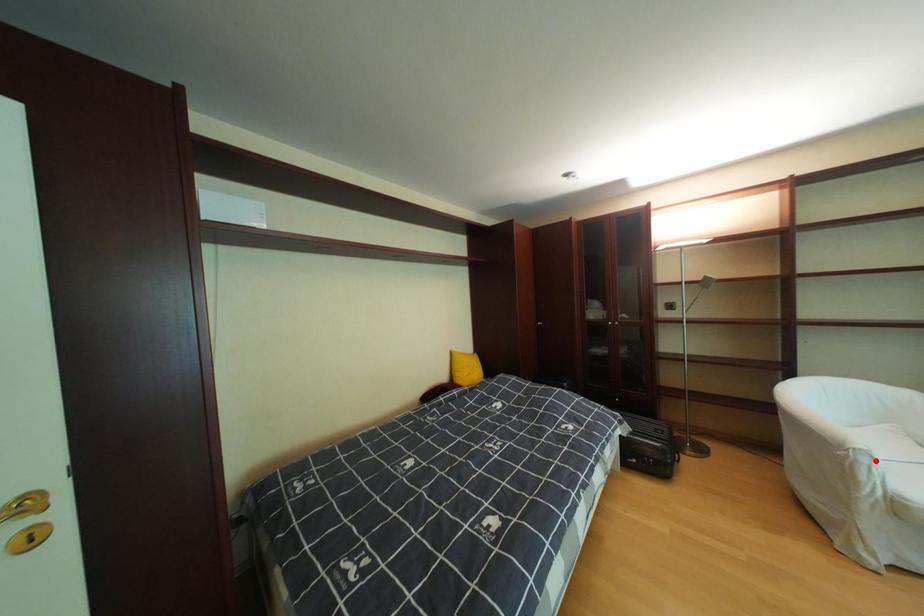
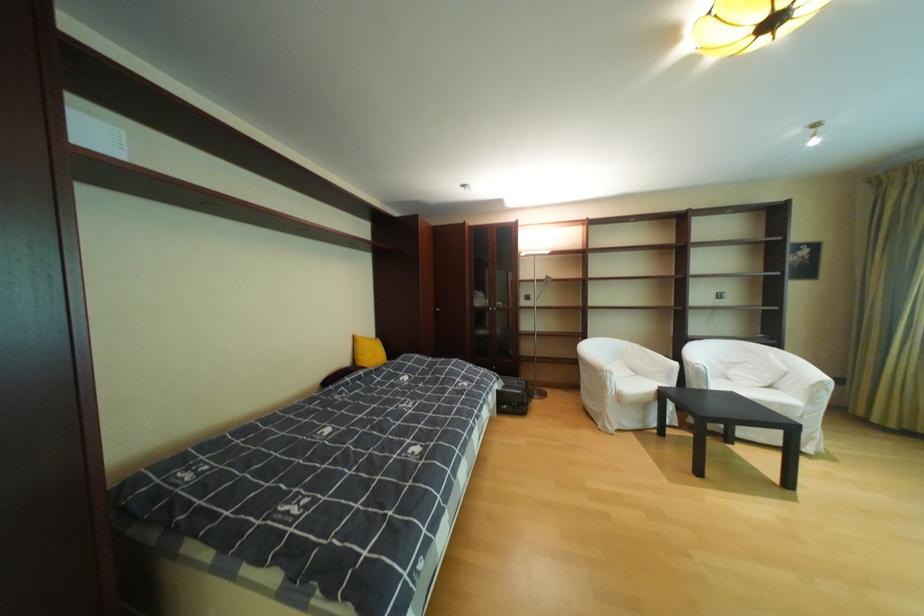
Question: I am providing you with two images of the same scene from different viewpoints. A red point is marked on the first image. Is the red point's position out of view in image 2?

Choices:
 (A) Yes
 (B) No

Answer: (B)